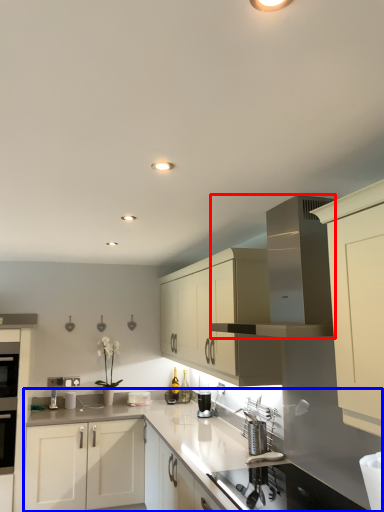
Question: Which point is closer to the camera, vent (highlighted by a red box) or countertop (highlighted by a blue box)?

Choices:
 (A) vent
 (B) countertop

Answer: (B)